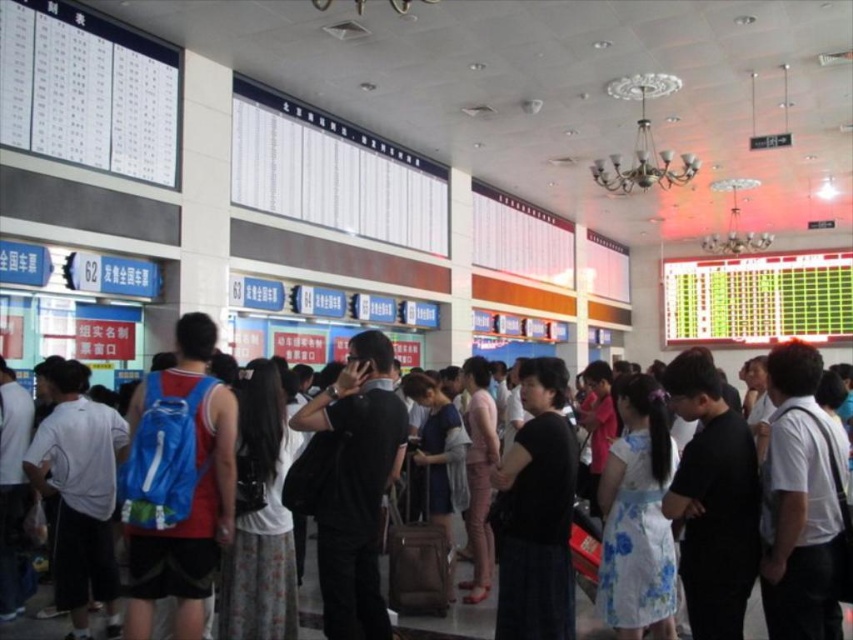
Question: Which point is farther to the camera?

Choices:
 (A) (109, 612)
 (B) (453, 468)
 (C) (271, 522)
 (D) (543, 472)

Answer: (B)

Question: Does white shirt at center appear over white matte backpack at left?

Choices:
 (A) no
 (B) yes

Answer: (A)

Question: From the image, what is the correct spatial relationship of blue fabric backpack at left in relation to black matte dress at center?

Choices:
 (A) right
 (B) left

Answer: (B)

Question: Which point is farther to the camera?

Choices:
 (A) blue fabric backpack at left
 (B) black matte backpack at center

Answer: (B)

Question: Which object is the farthest from the black matte backpack at center?

Choices:
 (A) brown fabric suitcase at center
 (B) light brown fabric backpack at center
 (C) white floral dress at center

Answer: (C)

Question: Does black matte dress at center appear on the left side of pink fabric pants at center?

Choices:
 (A) yes
 (B) no

Answer: (B)